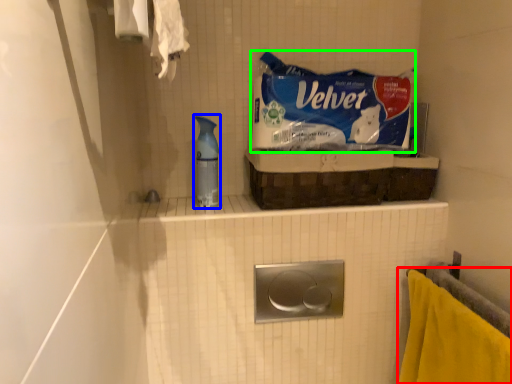
Question: Which is nearer to the towel (highlighted by a red box)? cleaning product (highlighted by a blue box) or product (highlighted by a green box).

Choices:
 (A) cleaning product
 (B) product

Answer: (B)